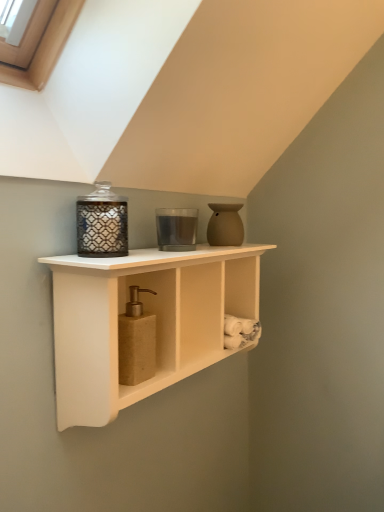
The image size is (384, 512). In order to click on free space in front of translucent glass candle at center, marked as the second candle holder in a front-to-back arrangement in this screenshot , I will do `click(137, 259)`.